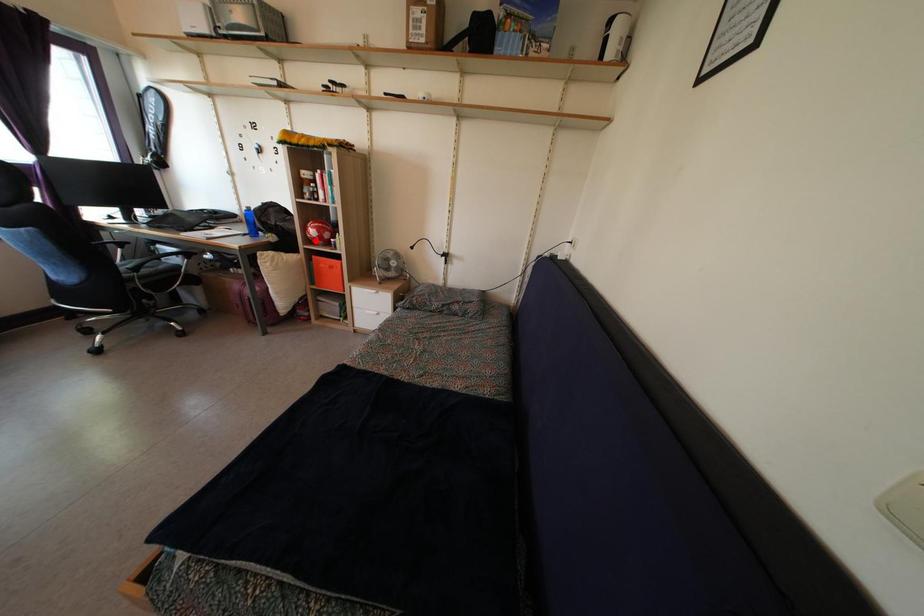
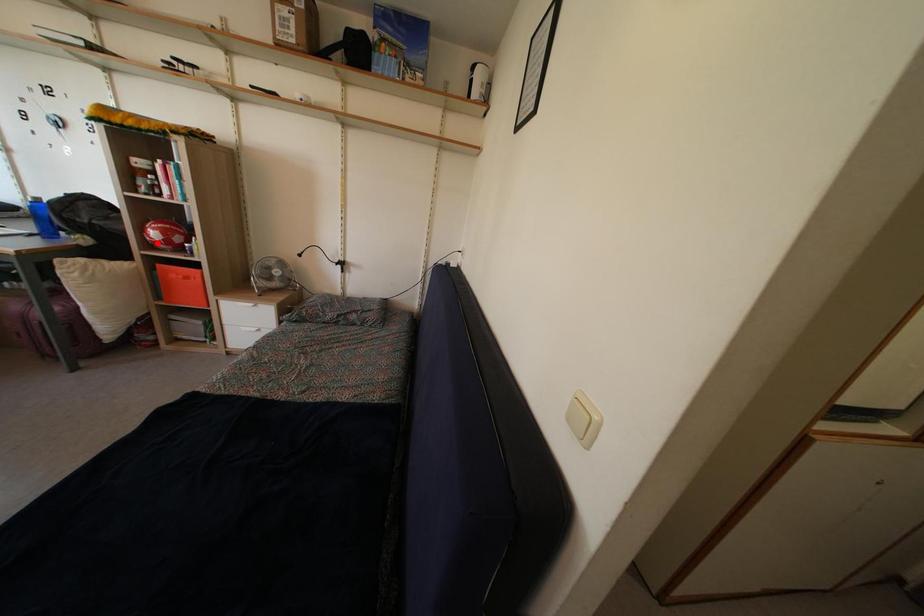
I am providing you with two images of the same scene from different viewpoints. A red point is marked on the first image and another point is marked on the second image. Is the red point in image1 aligned with the point shown in image2?

Yes